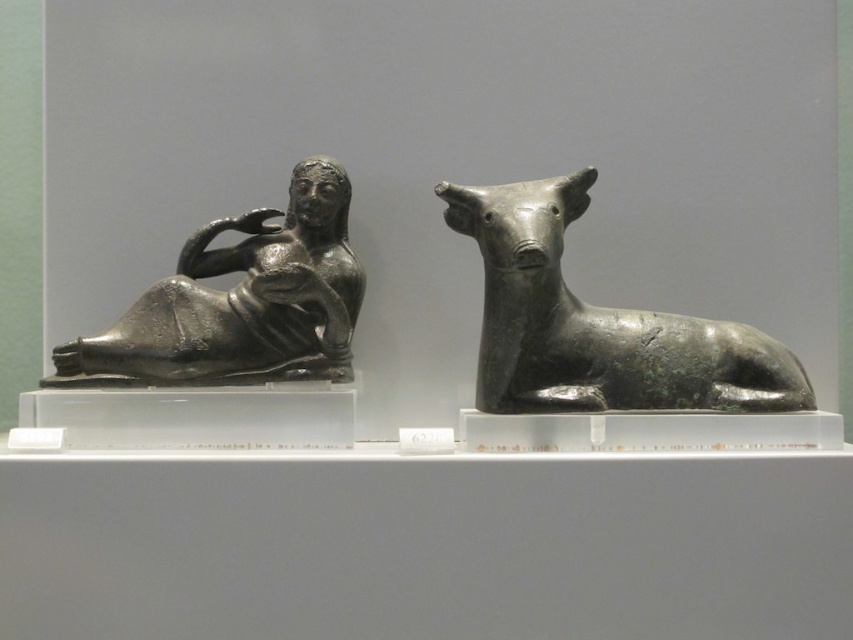
You are a curator standing at the center of the museum exhibit. You need to place a new plaque that must be equidistant from both the reclining figure sculpture and the bronze bull at right. Based on their 2D positions, where should you place the plaque?

The bronze bull at right is located at point (596, 324). To find the midpoint between the two sculptures, you would need the coordinates of the reclining figure sculpture as well. Since only the bronze bull at right has coordinates provided, the exact placement cannot be determined with the given information.

You are a museum curator planning to install a protective glass panel between the bronze bull at right and the polished bronze reclining figure at left. The panel must be tall enough to cover the tallest object. Which sculpture should the height of the glass panel be based on?

The bronze bull at right is much taller than the polished bronze reclining figure at left, so the glass panel should be based on the height of the bronze bull at right to ensure full coverage.